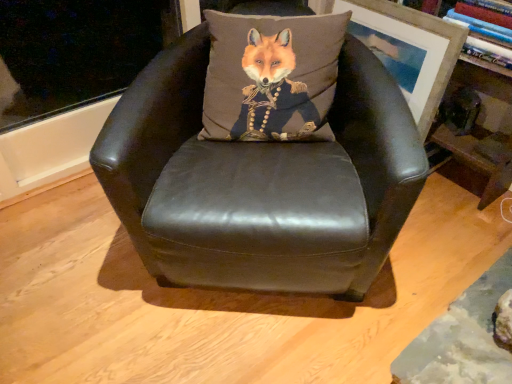
Locate an element on the screen. The height and width of the screenshot is (384, 512). wooden bookshelf at upper right is located at coordinates (483, 135).

Does wooden bookshelf at upper right have a larger size compared to matte black leather chair at center?

No, wooden bookshelf at upper right is not bigger than matte black leather chair at center.

Can you tell me how much wooden bookshelf at upper right and matte black leather chair at center differ in facing direction?

There is a 47.7-degree angle between the facing directions of wooden bookshelf at upper right and matte black leather chair at center.

Which object is more forward, wooden bookshelf at upper right or matte black leather chair at center?

matte black leather chair at center is closer to the camera.

From a real-world perspective, is wooden bookshelf at upper right over matte black leather chair at center?

Indeed, from a real-world perspective, wooden bookshelf at upper right stands above matte black leather chair at center.

Is matte black leather chair at center inside or outside of wooden picture frame at upper right?

matte black leather chair at center is outside wooden picture frame at upper right.

Would you consider matte black leather chair at center to be distant from wooden picture frame at upper right?

No, there isn't a large distance between matte black leather chair at center and wooden picture frame at upper right.

How different are the orientations of matte black leather chair at center and wooden picture frame at upper right in degrees?

They differ by 47.7 degrees in their facing directions.

Which object is wider, wooden picture frame at upper right or matte black leather chair at center?

matte black leather chair at center is wider.

How different are the orientations of wooden picture frame at upper right and matte black leather chair at center in degrees?

The facing directions of wooden picture frame at upper right and matte black leather chair at center are 47.7 degrees apart.

How far apart are wooden picture frame at upper right and matte black leather chair at center?

21.55 inches.

From a real-world perspective, between wooden picture frame at upper right and matte black leather chair at center, who is vertically lower?

In real-world perspective, matte black leather chair at center is lower.

Based on the photo, which is more to the right, wooden bookshelf at upper right or wooden picture frame at upper right?

wooden bookshelf at upper right.

I want to click on bookshelf that is below the wooden picture frame at upper right (from the image's perspective), so click(483, 135).

Considering the relative sizes of wooden bookshelf at upper right and wooden picture frame at upper right in the image provided, is wooden bookshelf at upper right taller than wooden picture frame at upper right?

Indeed, wooden bookshelf at upper right has a greater height compared to wooden picture frame at upper right.

Who is bigger, wooden bookshelf at upper right or wooden picture frame at upper right?

wooden bookshelf at upper right.

Is matte black leather chair at center outside of wooden bookshelf at upper right?

That's correct, matte black leather chair at center is outside of wooden bookshelf at upper right.

Considering the points (277, 187) and (490, 198), which point is behind, point (277, 187) or point (490, 198)?

The point (490, 198) is farther from the camera.

Which of these two, matte black leather chair at center or wooden bookshelf at upper right, is bigger?

Bigger between the two is matte black leather chair at center.

From the image's perspective, is wooden picture frame at upper right above or below wooden bookshelf at upper right?

Clearly, from the image's perspective, wooden picture frame at upper right is above wooden bookshelf at upper right.

Can wooden bookshelf at upper right be found inside wooden picture frame at upper right?

No, wooden picture frame at upper right does not contain wooden bookshelf at upper right.

Is wooden picture frame at upper right aimed at wooden bookshelf at upper right?

No, wooden picture frame at upper right is not aimed at wooden bookshelf at upper right.

Considering the relative positions of wooden picture frame at upper right and wooden bookshelf at upper right in the image provided, is wooden picture frame at upper right in front of wooden bookshelf at upper right?

No, wooden picture frame at upper right is behind wooden bookshelf at upper right.

At what (x,y) coordinates should I click in order to perform the action: click on chair that is in front of the wooden bookshelf at upper right. Please return your answer as a coordinate pair (x, y). Image resolution: width=512 pixels, height=384 pixels. Looking at the image, I should click on (261, 182).

Find the location of a particular element. This screenshot has height=384, width=512. picture frame behind the matte black leather chair at center is located at coordinates (409, 50).

Based on their spatial positions, is wooden bookshelf at upper right or matte black leather chair at center closer to wooden picture frame at upper right?

Among the two, wooden bookshelf at upper right is located nearer to wooden picture frame at upper right.

Which object lies further to the anchor point matte black leather chair at center, wooden bookshelf at upper right or wooden picture frame at upper right?

wooden bookshelf at upper right lies further to matte black leather chair at center than the other object.

Considering their positions, is wooden picture frame at upper right positioned closer to matte black leather chair at center than wooden bookshelf at upper right?

wooden picture frame at upper right is positioned closer to the anchor matte black leather chair at center.

From the image, which object appears to be farther from wooden bookshelf at upper right, matte black leather chair at center or wooden picture frame at upper right?

matte black leather chair at center is positioned further to the anchor wooden bookshelf at upper right.

When comparing their distances from wooden bookshelf at upper right, does wooden picture frame at upper right or matte black leather chair at center seem closer?

wooden picture frame at upper right is closer to wooden bookshelf at upper right.

Based on their spatial positions, is matte black leather chair at center or wooden bookshelf at upper right closer to wooden picture frame at upper right?

Among the two, wooden bookshelf at upper right is located nearer to wooden picture frame at upper right.

This screenshot has height=384, width=512. Identify the location of picture frame between matte black leather chair at center and wooden bookshelf at upper right. (409, 50).